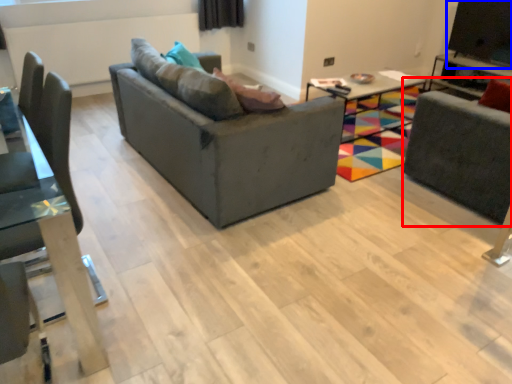
Question: Which object is further to the camera taking this photo, swivel chair (highlighted by a red box) or window screen (highlighted by a blue box)?

Choices:
 (A) swivel chair
 (B) window screen

Answer: (B)